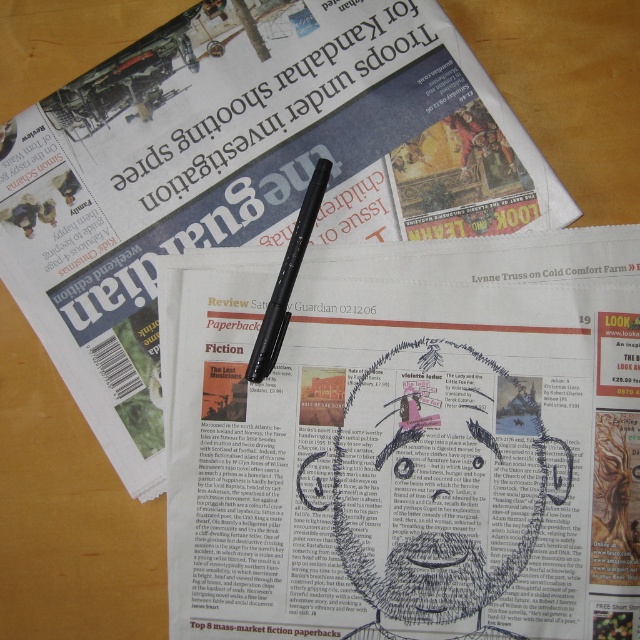
Question: From the image, what is the correct spatial relationship of white paper at center in relation to black plastic pen at center?

Choices:
 (A) below
 (B) above

Answer: (A)

Question: Is white paper at center to the right of black plastic pen at center from the viewer's perspective?

Choices:
 (A) no
 (B) yes

Answer: (B)

Question: Does white paper at center have a lesser width compared to black plastic pen at center?

Choices:
 (A) no
 (B) yes

Answer: (A)

Question: Which object is closer to the camera taking this photo?

Choices:
 (A) black plastic pen at center
 (B) white paper at center

Answer: (B)

Question: Which point is closer to the camera?

Choices:
 (A) white paper at center
 (B) black plastic pen at center

Answer: (A)